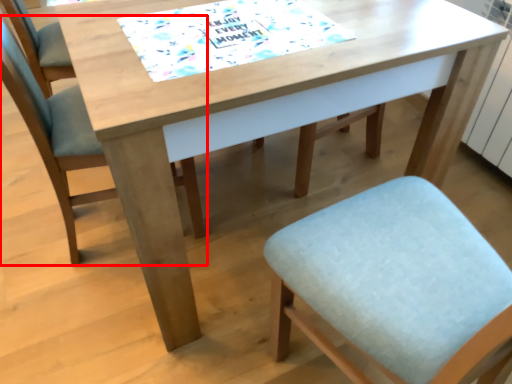
Question: From the image's perspective, what is the correct spatial positioning of chair (annotated by the red box) in reference to place mat?

Choices:
 (A) above
 (B) below

Answer: (B)